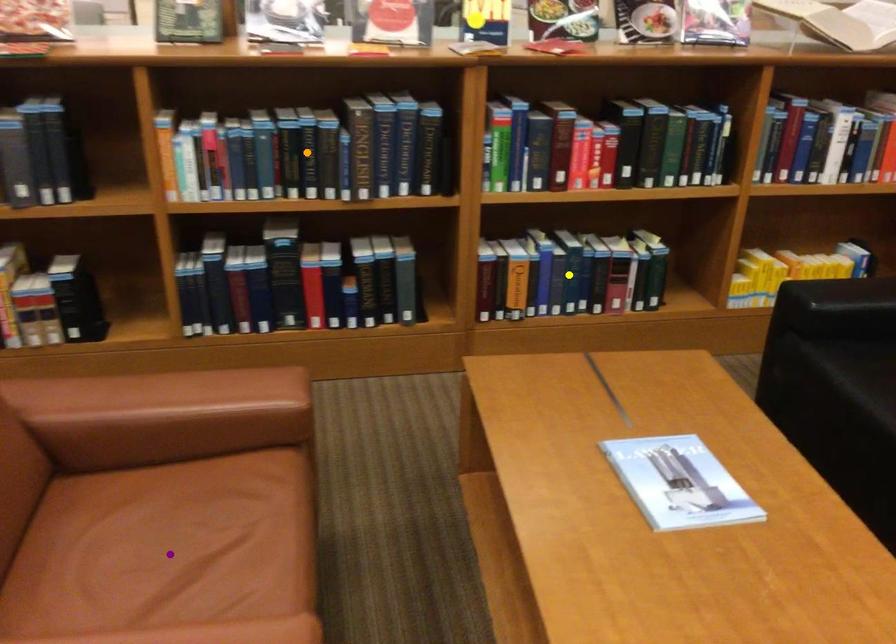
Order these from nearest to farthest:
1. yellow point
2. purple point
3. orange point

purple point, orange point, yellow point